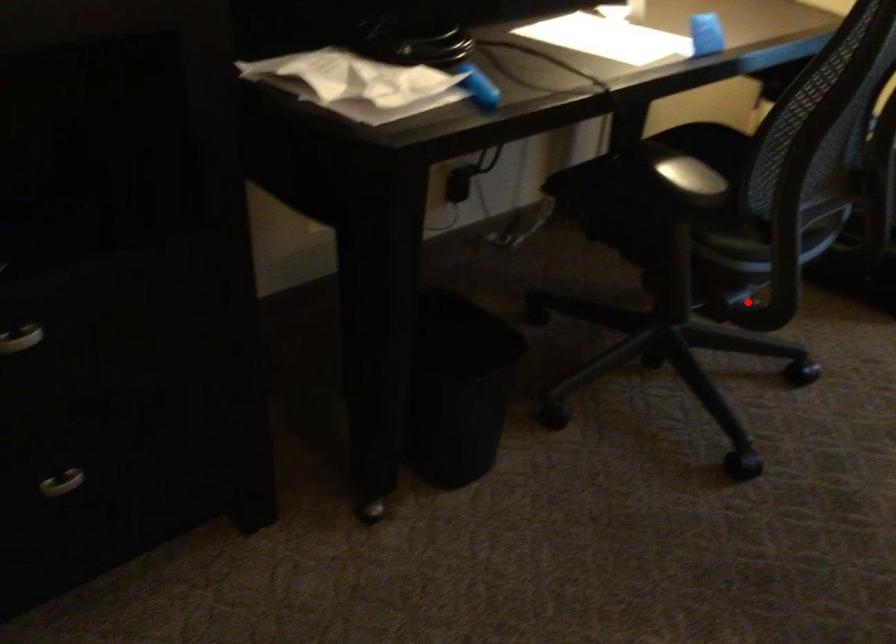
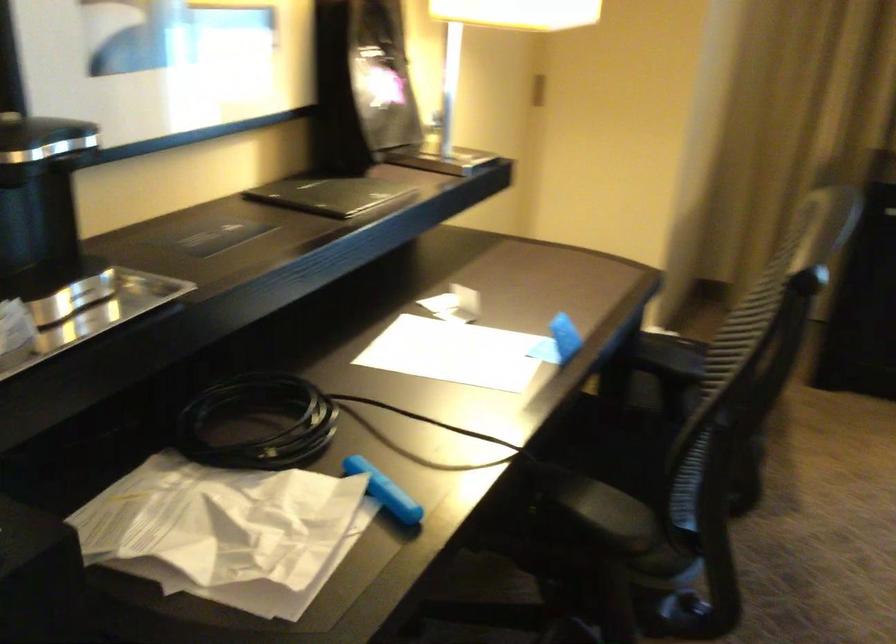
Question: I am providing you with two images of the same scene from different viewpoints. Given a red point in image1, look at the same physical point in image2. Is it:

Choices:
 (A) Closer to the viewpoint
 (B) Farther from the viewpoint

Answer: (A)